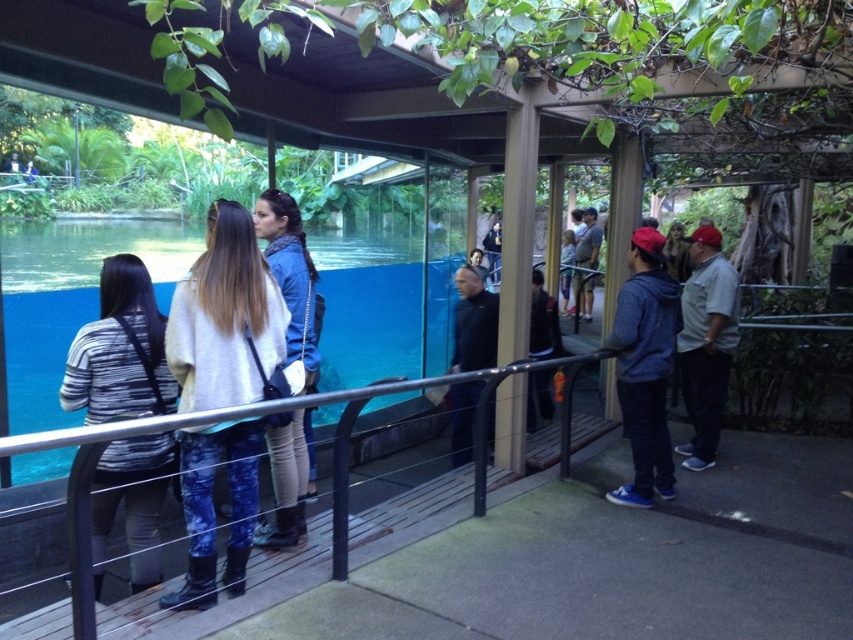
Question: Does metallic silver rail at center appear on the left side of striped sweater at left?

Choices:
 (A) yes
 (B) no

Answer: (B)

Question: Among these objects, which one is farthest from the camera?

Choices:
 (A) dark blue jacket at center
 (B) striped sweater at left
 (C) light beige sweater at center

Answer: (A)

Question: Which object is farther from the camera taking this photo?

Choices:
 (A) black matte jacket at center
 (B) striped sweater at left
 (C) denim jacket at right
 (D) light gray cotton shirt at right

Answer: (A)

Question: Can you confirm if denim jacket at right is positioned to the right of dark blue jacket at center?

Choices:
 (A) no
 (B) yes

Answer: (B)

Question: Is blue denim jacket at center bigger than black matte jacket at center?

Choices:
 (A) yes
 (B) no

Answer: (B)

Question: Among these points, which one is nearest to the camera?

Choices:
 (A) (576, 282)
 (B) (701, 291)
 (C) (469, 294)
 (D) (537, 317)

Answer: (B)